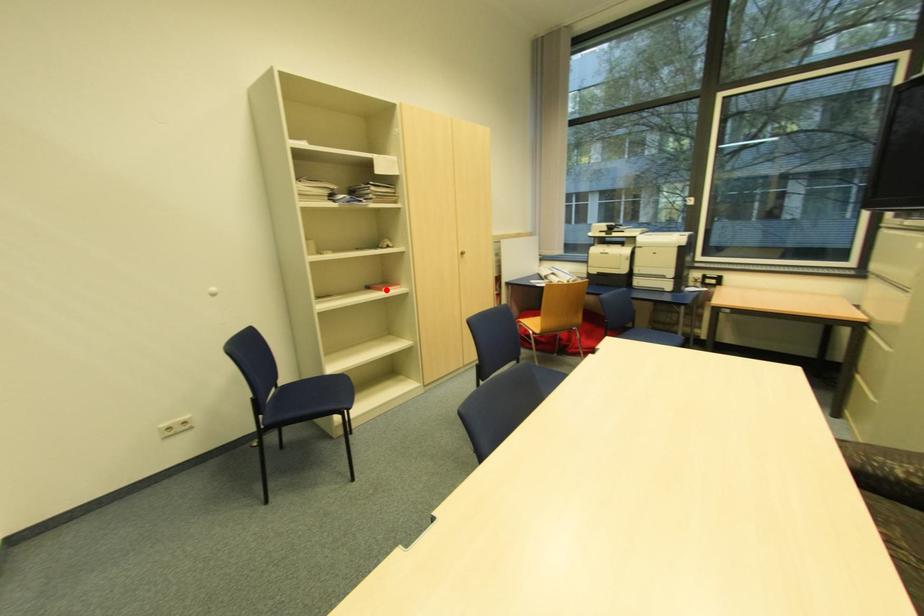
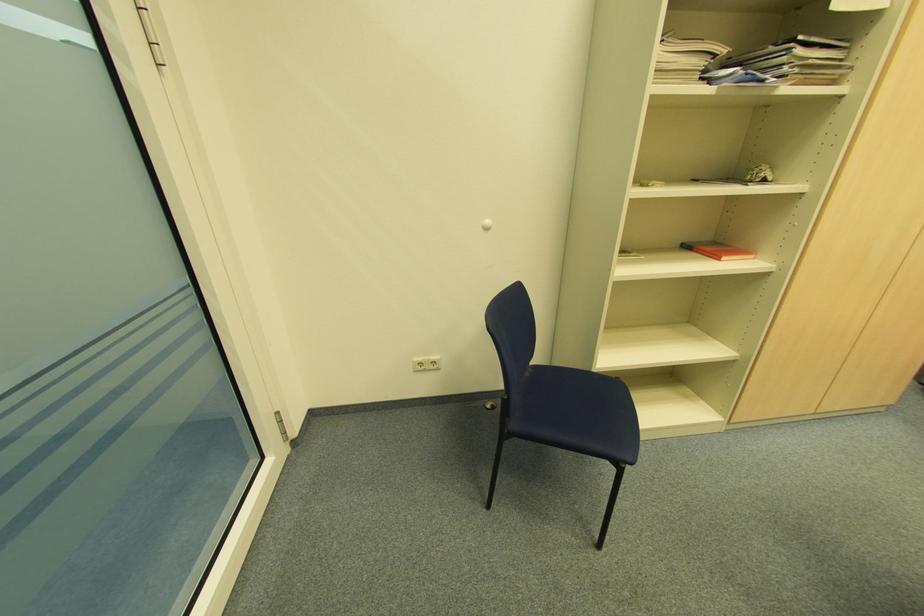
The point at the highlighted location is marked in the first image. Where is the corresponding point in the second image?

(726, 257)